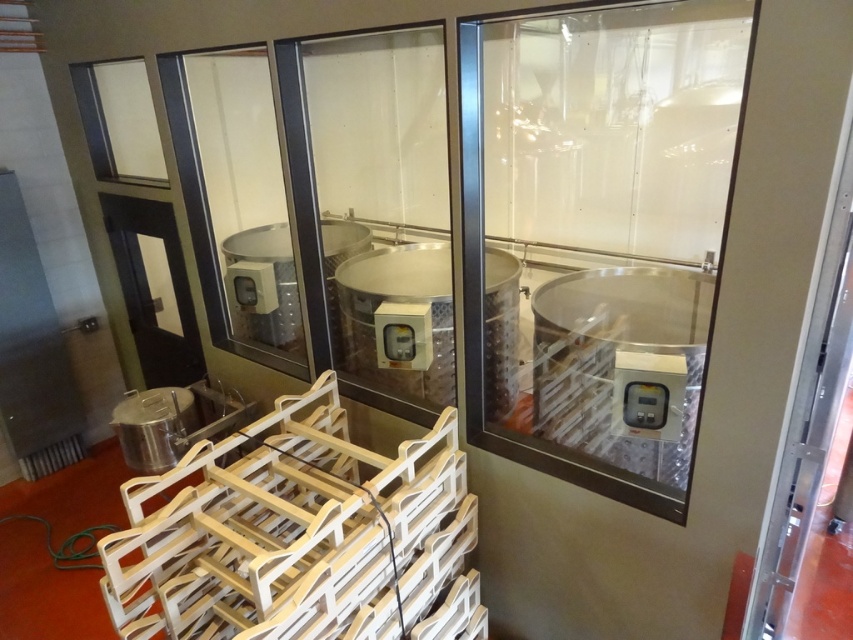
Question: Which object is farther from the camera taking this photo?

Choices:
 (A) transparent glass door at center
 (B) transparent plastic door at center
 (C) light wood crate at center

Answer: (A)

Question: Can you confirm if transparent plastic door at center is bigger than transparent glass door at center?

Choices:
 (A) yes
 (B) no

Answer: (A)

Question: Estimate the real-world distances between objects in this image. Which object is farther from the transparent glass door at center?

Choices:
 (A) transparent plastic door at center
 (B) light wood crate at center

Answer: (B)

Question: Is transparent plastic door at center closer to camera compared to light wood crate at center?

Choices:
 (A) yes
 (B) no

Answer: (A)

Question: Based on their relative distances, which object is nearer to the transparent plastic door at center?

Choices:
 (A) transparent glass door at center
 (B) light wood crate at center

Answer: (A)

Question: Can you confirm if light wood crate at center is wider than transparent glass door at center?

Choices:
 (A) yes
 (B) no

Answer: (A)